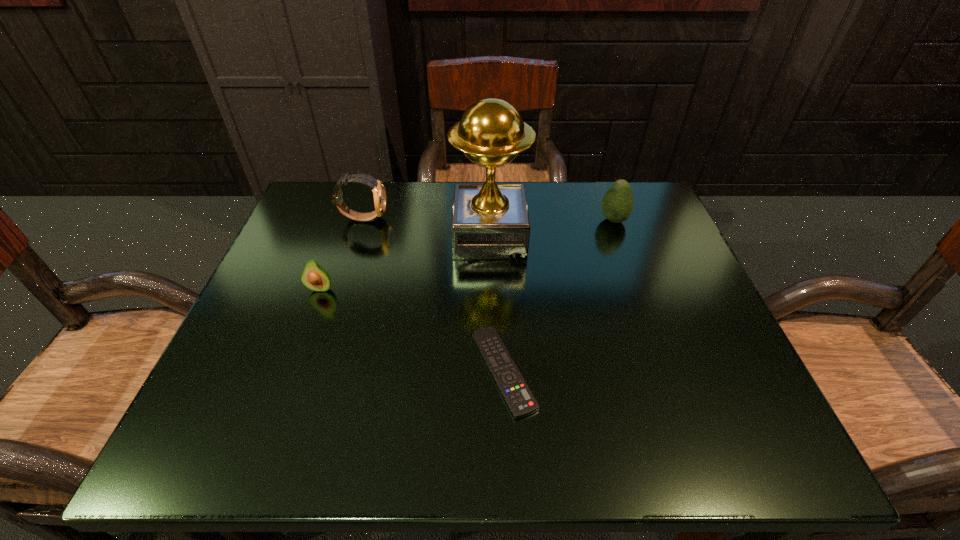
I want to click on award, so click(489, 221).

I want to click on watch, so click(x=379, y=194).

Where is `the farther avocado`? The height and width of the screenshot is (540, 960). the farther avocado is located at coordinates (617, 204).

The height and width of the screenshot is (540, 960). What are the coordinates of `the rightmost object` in the screenshot? It's located at (617, 204).

At what (x,y) coordinates should I click in order to perform the action: click on the second shortest object. Please return your answer as a coordinate pair (x, y). Image resolution: width=960 pixels, height=540 pixels. Looking at the image, I should click on (314, 277).

At what (x,y) coordinates should I click in order to perform the action: click on the nearer avocado. Please return your answer as a coordinate pair (x, y). This screenshot has height=540, width=960. Looking at the image, I should click on (314, 277).

Where is `remote control`? This screenshot has height=540, width=960. remote control is located at coordinates (515, 391).

Find the location of a particular element. The image size is (960, 540). the shortest object is located at coordinates (515, 391).

This screenshot has height=540, width=960. Identify the location of free space located 0.110m on the front-facing side of the award. (405, 235).

Where is `vacant position located on the front-facing side of the award`? The height and width of the screenshot is (540, 960). vacant position located on the front-facing side of the award is located at coordinates (396, 235).